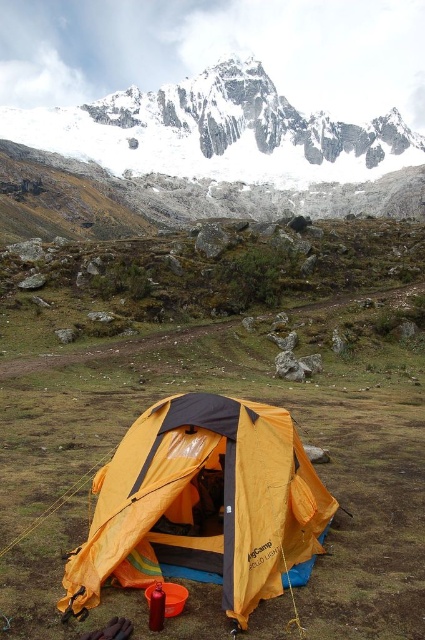
Based on the photo, does white snow-covered mountain at upper center have a larger size compared to yellow fabric tent at center?

Indeed, white snow-covered mountain at upper center has a larger size compared to yellow fabric tent at center.

Where is `white snow-covered mountain at upper center`? Image resolution: width=425 pixels, height=640 pixels. white snow-covered mountain at upper center is located at coordinates (221, 152).

Which is behind, point (161, 211) or point (184, 394)?

Positioned behind is point (161, 211).

The image size is (425, 640). Find the location of `white snow-covered mountain at upper center`. white snow-covered mountain at upper center is located at coordinates (221, 152).